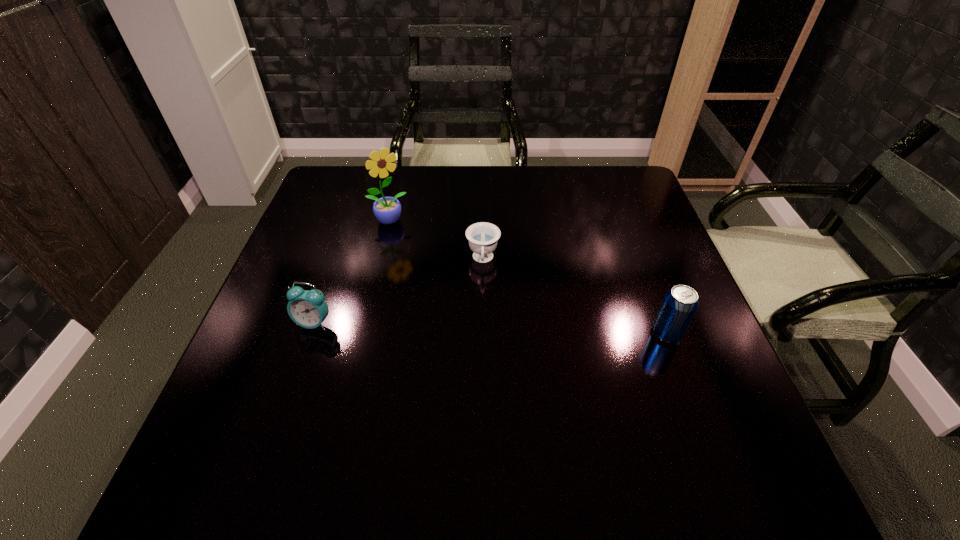
Where is `the leftmost object`? the leftmost object is located at coordinates (308, 309).

The width and height of the screenshot is (960, 540). I want to click on the rightmost object, so click(x=680, y=303).

Locate an element on the screen. Image resolution: width=960 pixels, height=540 pixels. the third nearest object is located at coordinates (482, 236).

Image resolution: width=960 pixels, height=540 pixels. In order to click on teacup in this screenshot , I will do `click(482, 236)`.

Locate an element on the screen. Image resolution: width=960 pixels, height=540 pixels. the tallest object is located at coordinates (387, 210).

I want to click on the farthest object, so click(x=387, y=210).

I want to click on vacant space located on the face of the leftmost object, so click(302, 356).

Image resolution: width=960 pixels, height=540 pixels. In order to click on vacant area situated 0.160m on the back of the beer can in this screenshot , I will do `click(643, 271)`.

Where is `vacant space located on the side of the second farthest object with the handle`? vacant space located on the side of the second farthest object with the handle is located at coordinates (480, 392).

Where is `blank area located 0.340m on the side of the second farthest object with the handle`? The width and height of the screenshot is (960, 540). blank area located 0.340m on the side of the second farthest object with the handle is located at coordinates (479, 401).